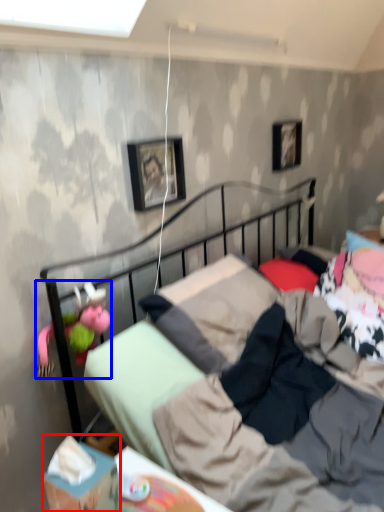
Question: Which point is closer to the camera, box (highlighted by a red box) or doll (highlighted by a blue box)?

Choices:
 (A) box
 (B) doll

Answer: (A)